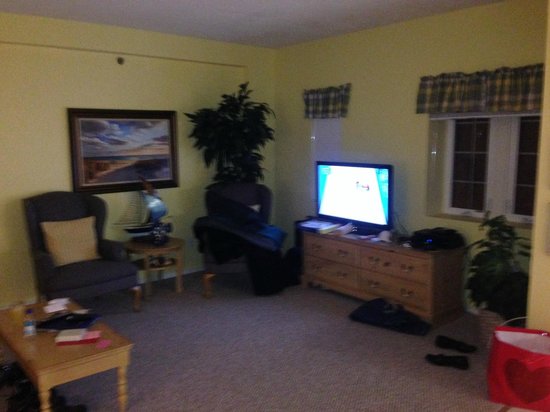
Where is `curtains`? This screenshot has height=412, width=550. curtains is located at coordinates (320, 99), (477, 93).